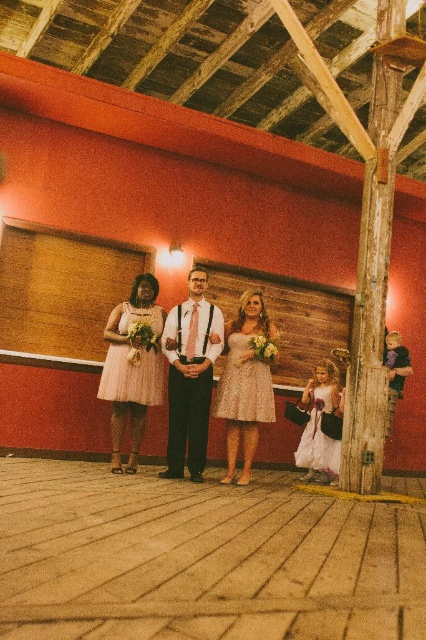
Question: Which object is positioned closest to the lace dress at center?

Choices:
 (A) light pink satin dress at center
 (B) white lace dress at lower right
 (C) pink satin dress at center

Answer: (A)

Question: Which of the following is the farthest from the observer?

Choices:
 (A) light pink satin dress at center
 (B) pink satin tie at center
 (C) pink tulle dress at center

Answer: (A)

Question: Estimate the real-world distances between objects in this image. Which object is farther from the light pink satin dress at center?

Choices:
 (A) white lace dress at lower right
 (B) glittery lace dress at center
 (C) lace dress at center

Answer: (A)

Question: In this image, where is light pink satin dress at center located relative to white lace dress at lower right?

Choices:
 (A) left
 (B) right

Answer: (A)

Question: Does pink satin tie at center lie in front of light pink satin dress at center?

Choices:
 (A) yes
 (B) no

Answer: (A)

Question: Can you confirm if pink satin dress at center is bigger than light pink satin dress at center?

Choices:
 (A) no
 (B) yes

Answer: (B)